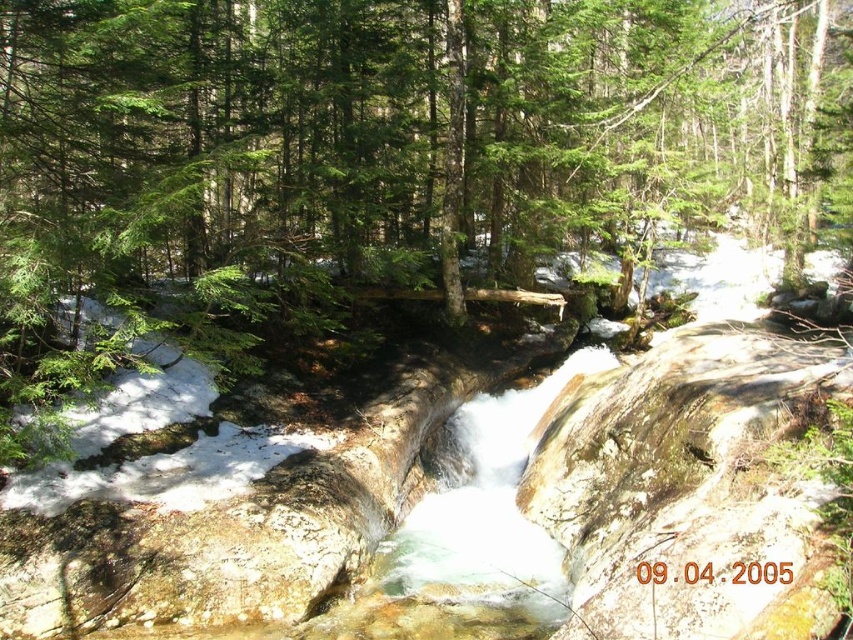
You are standing in the forest and want to take a photo of the green matte tree at center and the clear water at center. Which object will appear larger in your photo?

The green matte tree at center will appear larger in the photo because it is closer to the viewer than the clear water at center.

You are a hiker with a 30 feet long rope. You need to cross the stream but there is a gap between the green matte tree at center and the clear water at center. Can you use your rope to bridge the gap?

The distance between the green matte tree at center and the clear water at center is 38.58 feet. Since your rope is only 30 feet long, it is not long enough to bridge the gap between the green matte tree at center and the clear water at center.